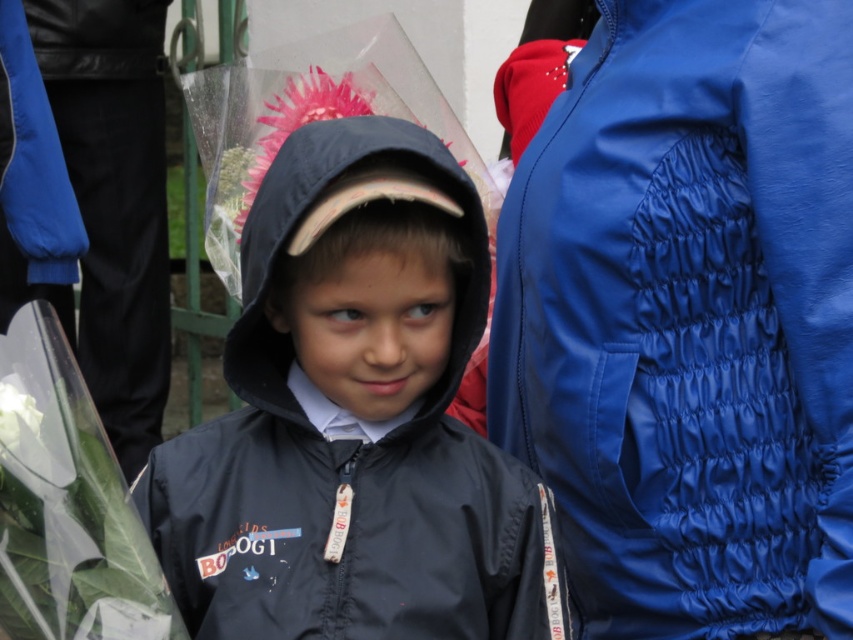
You are a photographer trying to capture a group photo. You notice the blue quilted jacket at right and the matte black jacket at center in your frame. Which jacket is positioned to the right of the other?

The blue quilted jacket at right is positioned on the right side of matte black jacket at center.

You are taking a photo of the scene. You want to focus on the point at point (714,147) and point (369,100). Which point should you focus on first to ensure both are in focus?

Point (714,147) is closer to the camera than point (369,100). To ensure both are in focus, you should focus on the closer point first, which is point (714,147).

You are standing at point [682,554] and want to walk to the other side of the image. The image has a scale where 1 unit equals 1 meter. Is the distance from your current position to the edge of the image sufficient to reach the other side?

The distance from your current position to the edge of the image is 2.57 meters, which is sufficient to reach the other side.